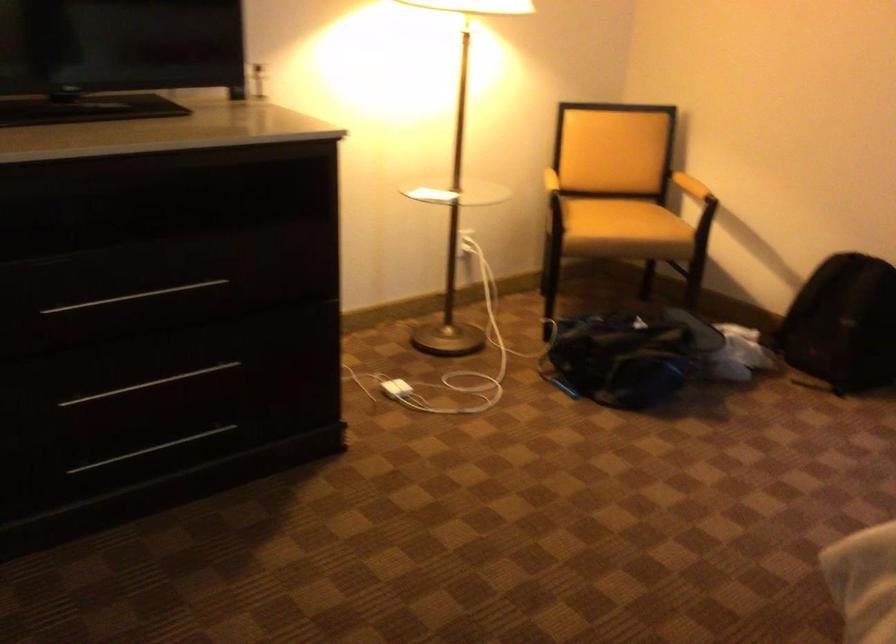
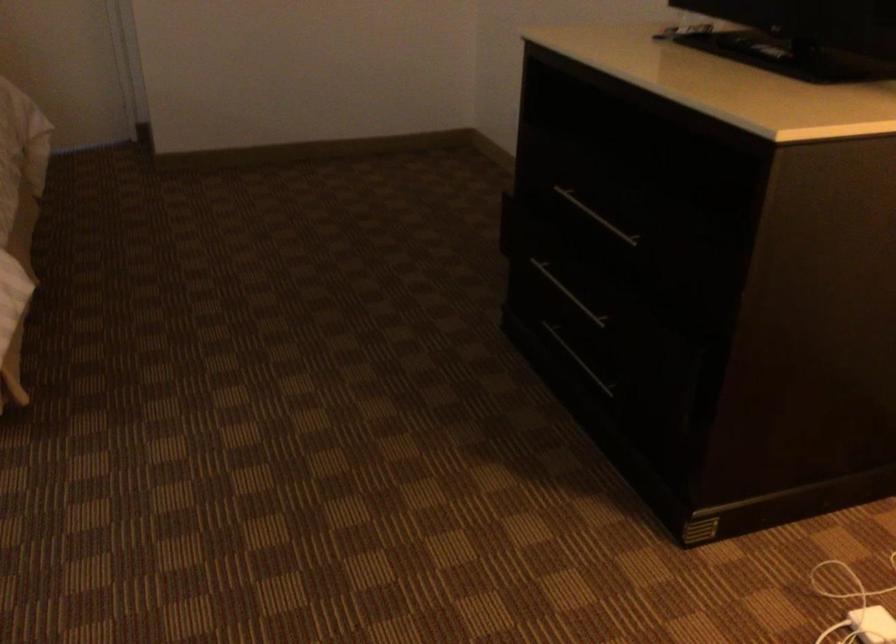
Locate, in the second image, the point that corresponds to pixel 383 402 in the first image.

(872, 625)